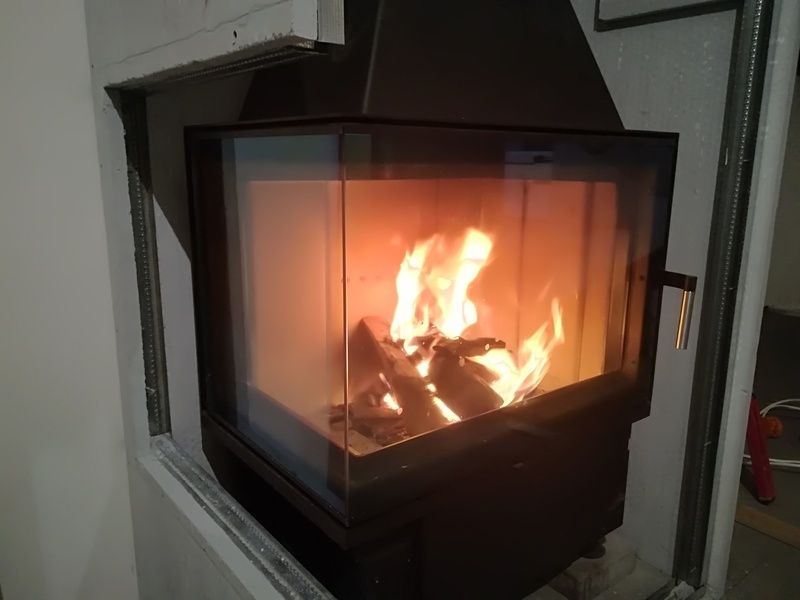
Locate an element on the screen. The width and height of the screenshot is (800, 600). glass is located at coordinates (305, 262), (548, 240).